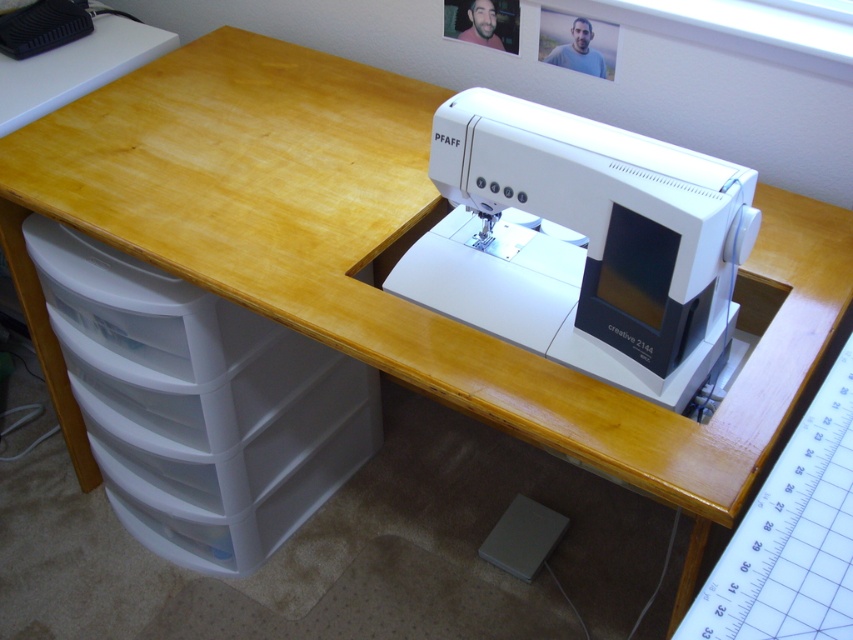
You are setting up a sewing project and need to place a 12x12 inch square pattern template on the desk. The template must be placed between the white plastic sewing machine at center and the white plastic drawer at lower left. Considering their sizes, will there be enough space for the template?

The white plastic sewing machine at center is smaller than the white plastic drawer at lower left. Since the template needs to be placed between them, the total space between the two objects must accommodate the 12x12 inch template. However, without specific distance information between them, we cannot definitively confirm if there is enough space. The answer depends on the actual spacing between the two objects, which isn

You are a tailor who needs to move a pair of scissors from the white plastic drawer at lower left to the white plastic sewing machine at center. What is the shortest distance you need to move the scissors?

The shortest distance you need to move the scissors is 25.46 inches, which is the distance between the white plastic sewing machine at center and the white plastic drawer at lower left.

You are planning to place a new sewing kit on the desk between the white plastic sewing machine at center and the white plastic drawer at lower left. The sewing kit requires a space that is wider than the widest object between them. Which object should you consider for determining the minimum required width of the sewing kit?

The white plastic drawer at lower left is wider than the white plastic sewing machine at center. Therefore, you should consider the white plastic drawer at lower left to determine the minimum required width of the sewing kit since it is the wider object between the two.